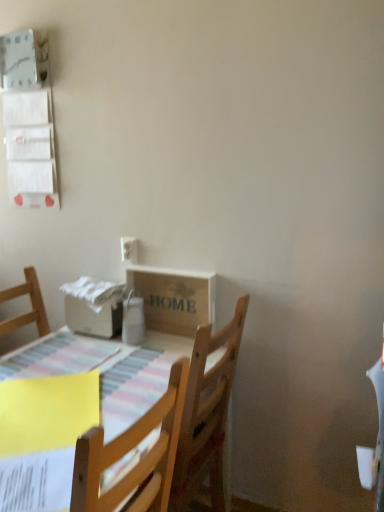
The image size is (384, 512). What are the coordinates of `vacant region to the left of wooden crate at center` in the screenshot? It's located at (118, 350).